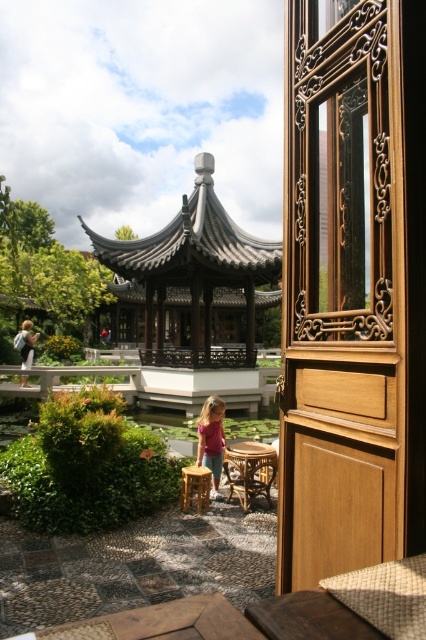
Question: Is green leafy bush at lower left to the right of light brown hair at center from the viewer's perspective?

Choices:
 (A) no
 (B) yes

Answer: (B)

Question: Which point is closer to the camera?

Choices:
 (A) green leafy bush at lower left
 (B) wooden carved door at right
 (C) pink fabric dress at center
 (D) rustic wood stool at center

Answer: (B)

Question: Among these objects, which one is farthest from the camera?

Choices:
 (A) pink fabric dress at center
 (B) light brown hair at center
 (C) wooden carved door at right
 (D) rustic wood stool at center

Answer: (B)

Question: Does wooden carved door at right lie behind green leafy bush at lower left?

Choices:
 (A) no
 (B) yes

Answer: (A)

Question: Is dark gray wooden gazebo at center positioned behind pink fabric dress at center?

Choices:
 (A) yes
 (B) no

Answer: (A)

Question: Which point is closer to the camera taking this photo?

Choices:
 (A) (196, 474)
 (B) (227, 234)
 (C) (19, 337)

Answer: (A)